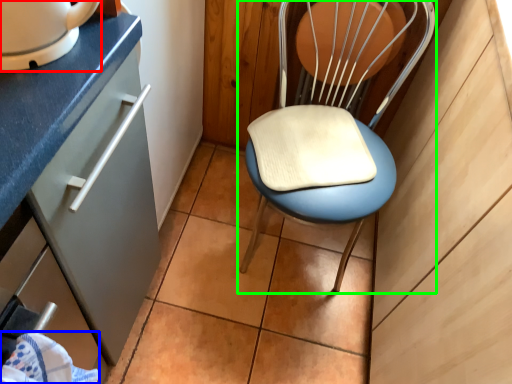
Question: Which object is the farthest from home appliance (highlighted by a red box)? Choose among these: material (highlighted by a blue box) or chair (highlighted by a green box).

Choices:
 (A) material
 (B) chair

Answer: (B)